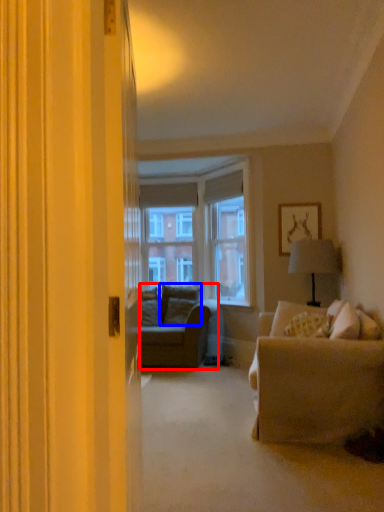
Question: Which object is closer to the camera taking this photo, studio couch (highlighted by a red box) or pillow (highlighted by a blue box)?

Choices:
 (A) studio couch
 (B) pillow

Answer: (A)